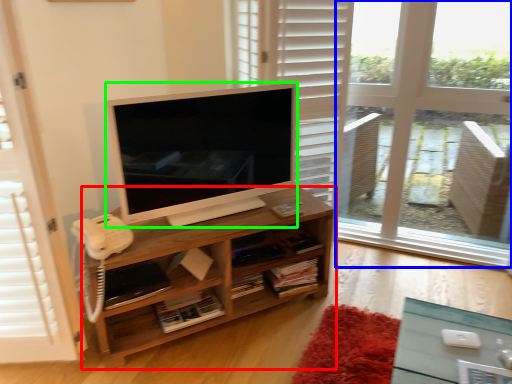
Question: Which is nearer to the shelf (highlighted by a red box)? window frame (highlighted by a blue box) or television (highlighted by a green box).

Choices:
 (A) window frame
 (B) television

Answer: (B)